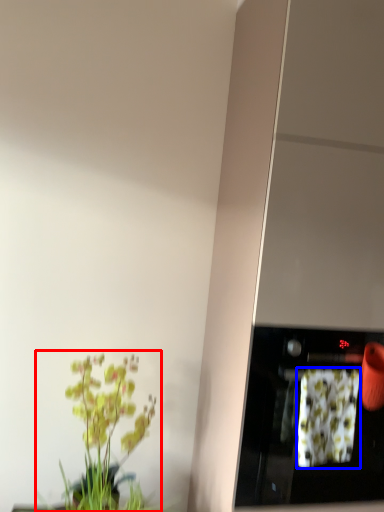
Question: Which object is closer to the camera taking this photo, houseplant (highlighted by a red box) or flower (highlighted by a blue box)?

Choices:
 (A) houseplant
 (B) flower

Answer: (B)